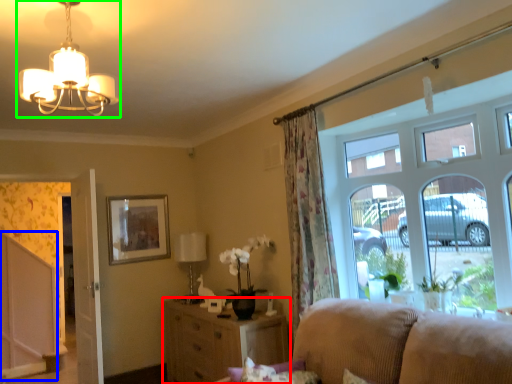
Question: Considering the real-world distances, which object is farthest from cabinetry (highlighted by a red box)? screen door (highlighted by a blue box) or lamp (highlighted by a green box)?

Choices:
 (A) screen door
 (B) lamp

Answer: (B)